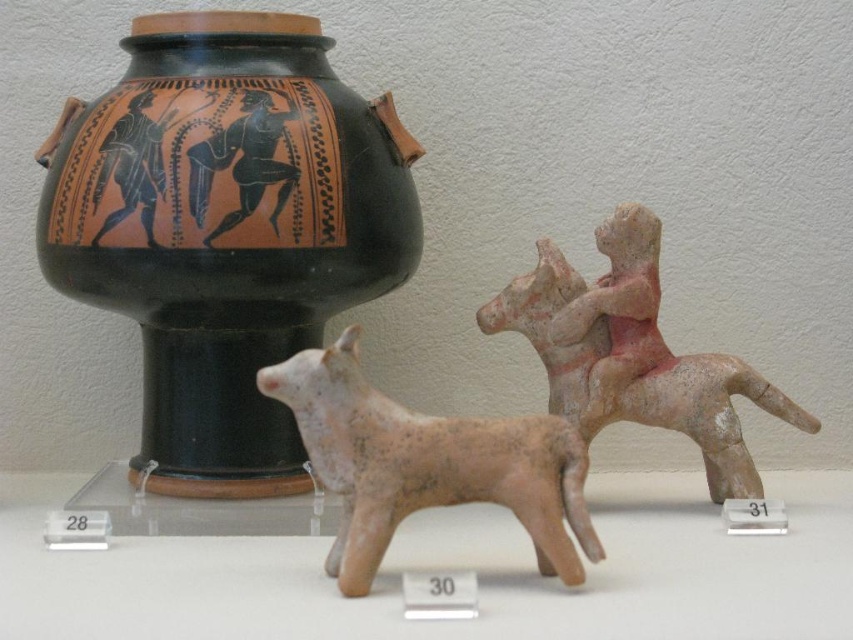
Can you confirm if black matte vase at upper left is taller than matte pink clay horse rider at right?

Indeed, black matte vase at upper left has a greater height compared to matte pink clay horse rider at right.

Who is lower down, black matte vase at upper left or matte pink clay horse rider at right?

matte pink clay horse rider at right

Who is more distant from viewer, (387, 109) or (664, 385)?

Positioned behind is point (664, 385).

In order to click on black matte vase at upper left in this screenshot , I will do `click(225, 228)`.

Between matte clay dog at center and matte pink clay horse rider at right, which one appears on the right side from the viewer's perspective?

matte pink clay horse rider at right is more to the right.

The image size is (853, 640). In order to click on matte clay dog at center in this screenshot , I will do `click(427, 465)`.

The width and height of the screenshot is (853, 640). I want to click on matte clay dog at center, so click(x=427, y=465).

Which of these two, black matte vase at upper left or matte clay dog at center, stands taller?

black matte vase at upper left is taller.

Which is above, black matte vase at upper left or matte clay dog at center?

black matte vase at upper left is higher up.

Does point (349, 132) come behind point (392, 428)?

That is True.

Locate an element on the screen. This screenshot has height=640, width=853. black matte vase at upper left is located at coordinates (225, 228).